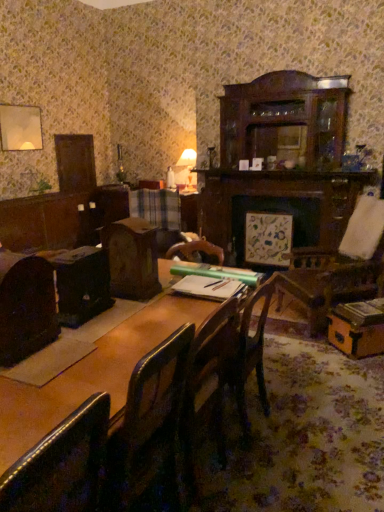
Question: Could you tell me if dark brown leather chair at left, arranged as the 1th chair when viewed from the back, is turned towards leather at left, the 1th chair in the front-to-back sequence?

Choices:
 (A) yes
 (B) no

Answer: (B)

Question: Can you confirm if dark brown leather chair at left, positioned as the second chair in bottom-to-top order, is positioned to the left of leather at left, which ranks as the first chair in bottom-to-top order?

Choices:
 (A) yes
 (B) no

Answer: (A)

Question: Does dark brown leather chair at left, which is the 2th chair in front-to-back order, appear on the right side of leather at left, the 1th chair in the front-to-back sequence?

Choices:
 (A) no
 (B) yes

Answer: (A)

Question: From a real-world perspective, does dark brown leather chair at left, positioned as the second chair in bottom-to-top order, stand above leather at left, which is the second chair in top-to-bottom order?

Choices:
 (A) yes
 (B) no

Answer: (A)

Question: Can you confirm if dark brown leather chair at left, which is the 2th chair in front-to-back order, is taller than leather at left, the 2th chair positioned from the back?

Choices:
 (A) no
 (B) yes

Answer: (A)

Question: Is leather at left, which ranks as the first chair in bottom-to-top order, to the left or to the right of dark brown leather chair at left, positioned as the second chair in bottom-to-top order, in the image?

Choices:
 (A) left
 (B) right

Answer: (B)

Question: In terms of width, does leather at left, the 1th chair in the front-to-back sequence, look wider or thinner when compared to dark brown leather chair at left, positioned as the 1th chair in top-to-bottom order?

Choices:
 (A) thin
 (B) wide

Answer: (B)

Question: Is point (74, 450) positioned closer to the camera than point (39, 320)?

Choices:
 (A) farther
 (B) closer

Answer: (B)

Question: In terms of height, does leather at left, which ranks as the first chair in bottom-to-top order, look taller or shorter compared to dark brown leather chair at left, which is the 2th chair in front-to-back order?

Choices:
 (A) tall
 (B) short

Answer: (A)

Question: In terms of height, does leather at left, which is the second chair in top-to-bottom order, look taller or shorter compared to wooden table at center?

Choices:
 (A) tall
 (B) short

Answer: (B)

Question: Visually, is leather at left, the 2th chair positioned from the back, positioned to the left or to the right of wooden table at center?

Choices:
 (A) left
 (B) right

Answer: (A)

Question: Is point (87, 505) positioned closer to the camera than point (147, 316)?

Choices:
 (A) closer
 (B) farther

Answer: (A)

Question: Is leather at left, which ranks as the first chair in bottom-to-top order, bigger or smaller than wooden table at center?

Choices:
 (A) small
 (B) big

Answer: (A)

Question: Is point (56, 305) positioned closer to the camera than point (180, 183)?

Choices:
 (A) closer
 (B) farther

Answer: (A)

Question: Based on their sizes in the image, would you say dark brown leather chair at left, positioned as the second chair in bottom-to-top order, is bigger or smaller than matte white table lamp at upper center?

Choices:
 (A) big
 (B) small

Answer: (B)